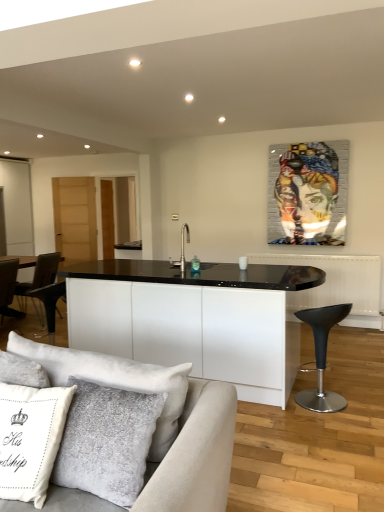
Question: Is black matte sink at center far away from beige fabric couch at lower left?

Choices:
 (A) yes
 (B) no

Answer: (A)

Question: Is the position of black matte sink at center more distant than that of beige fabric couch at lower left?

Choices:
 (A) no
 (B) yes

Answer: (B)

Question: Is black matte sink at center facing away from beige fabric couch at lower left?

Choices:
 (A) no
 (B) yes

Answer: (B)

Question: Considering the relative sizes of black matte sink at center and beige fabric couch at lower left in the image provided, is black matte sink at center taller than beige fabric couch at lower left?

Choices:
 (A) yes
 (B) no

Answer: (B)

Question: From a real-world perspective, is black matte sink at center below beige fabric couch at lower left?

Choices:
 (A) yes
 (B) no

Answer: (B)

Question: From the image's perspective, would you say black matte sink at center is positioned over beige fabric couch at lower left?

Choices:
 (A) no
 (B) yes

Answer: (B)

Question: Is metallic mosaic portrait at upper center facing away from transparent glass door at left?

Choices:
 (A) yes
 (B) no

Answer: (B)

Question: From a real-world perspective, is metallic mosaic portrait at upper center positioned over transparent glass door at left based on gravity?

Choices:
 (A) yes
 (B) no

Answer: (A)

Question: Is metallic mosaic portrait at upper center further to the viewer compared to transparent glass door at left?

Choices:
 (A) yes
 (B) no

Answer: (B)

Question: Is metallic mosaic portrait at upper center positioned before transparent glass door at left?

Choices:
 (A) yes
 (B) no

Answer: (A)

Question: Is metallic mosaic portrait at upper center at the right side of transparent glass door at left?

Choices:
 (A) no
 (B) yes

Answer: (B)

Question: From the image's perspective, does metallic mosaic portrait at upper center appear higher than transparent glass door at left?

Choices:
 (A) no
 (B) yes

Answer: (A)

Question: From a real-world perspective, is transparent glass door at left over black leather stool at lower right?

Choices:
 (A) no
 (B) yes

Answer: (B)